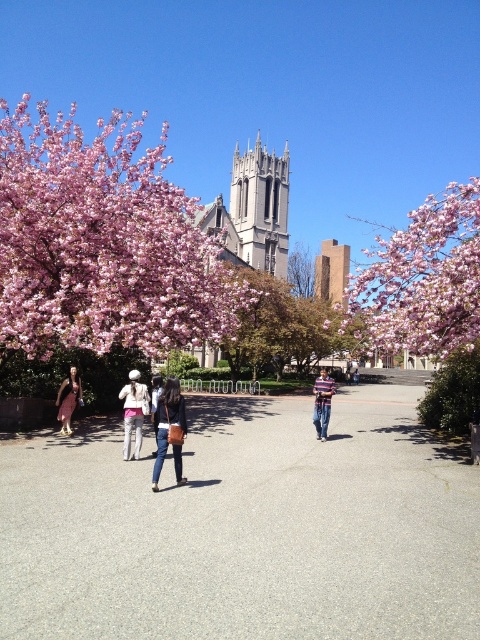
Does pink blossoms at upper left have a greater height compared to matte brown dress at lower left?

Yes.

Who is positioned more to the right, pink blossoms at upper left or matte brown dress at lower left?

matte brown dress at lower left

Where is `pink blossoms at upper left`? The height and width of the screenshot is (640, 480). pink blossoms at upper left is located at coordinates (x=103, y=243).

Can you confirm if gray stone tower at center is taller than denim jacket at center?

Yes, gray stone tower at center is taller than denim jacket at center.

Is gray stone tower at center wider than denim jacket at center?

Answer: Yes, gray stone tower at center is wider than denim jacket at center.

Where is `gray stone tower at center`? gray stone tower at center is located at coordinates (261, 205).

Is denim jeans at center closer to the viewer compared to denim jacket at center?

Yes, it is in front of denim jacket at center.

Is point (170, 380) closer to camera compared to point (156, 385)?

Yes, it is in front of point (156, 385).

You are a GUI agent. You are given a task and a screenshot of the screen. Output one action in this format:
    pyautogui.click(x=<x>, y=<y>)
    Task: Click on the denim jeans at center
    
    Given the screenshot: What is the action you would take?
    pyautogui.click(x=169, y=429)